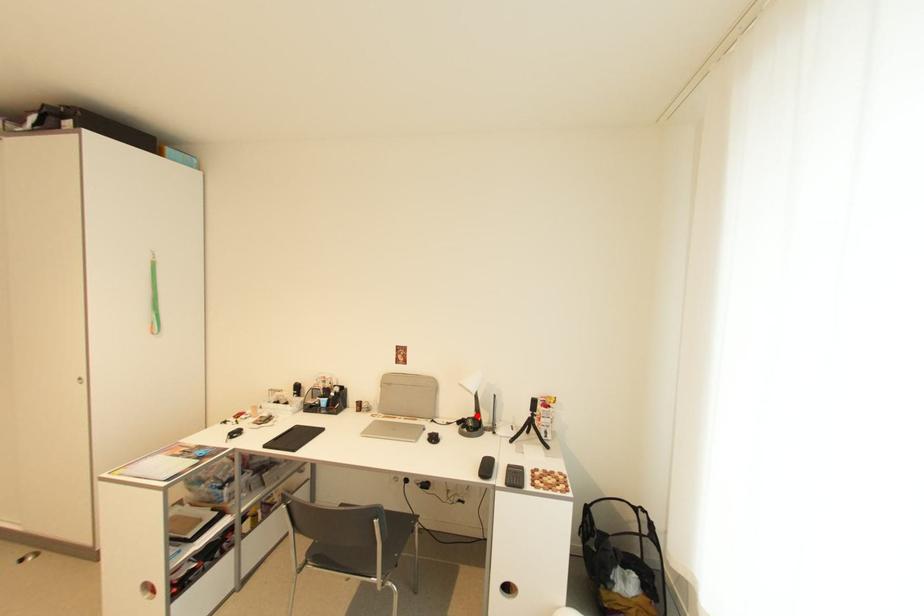
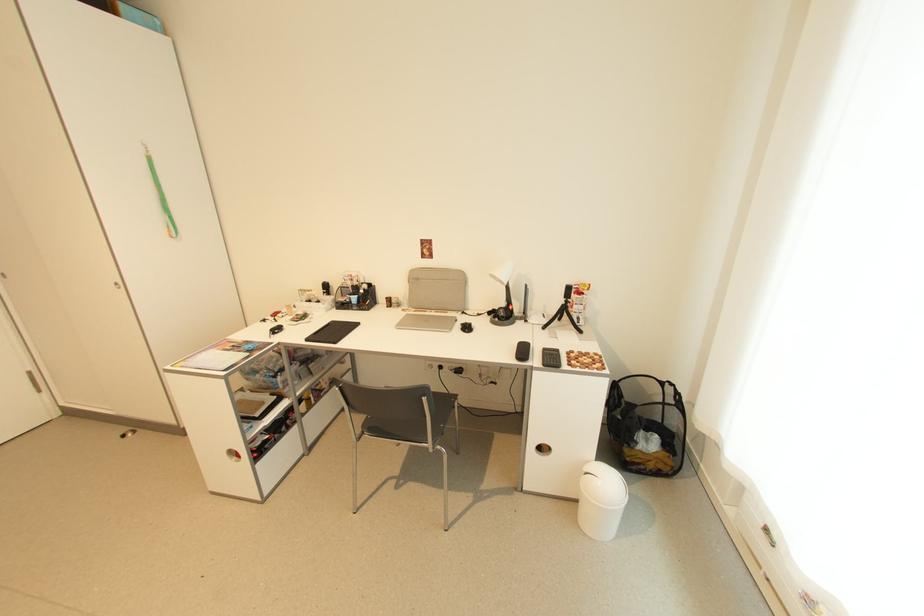
Find the pixel in the second image that matches the highlighted location in the first image.

(507, 306)